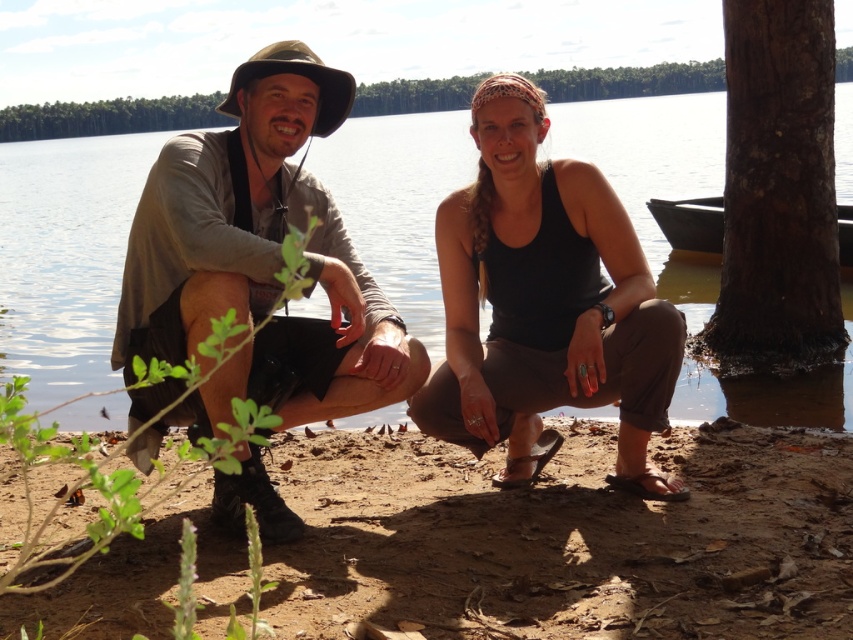
Question: Which point is closer to the camera?

Choices:
 (A) (846, 260)
 (B) (219, 97)

Answer: (A)

Question: Based on their relative distances, which object is nearer to the brown dirt at lower center?

Choices:
 (A) dark brown wooden canoe at right
 (B) matte gray shirt at center

Answer: (B)

Question: Estimate the real-world distances between objects in this image. Which object is closer to the dark brown wooden canoe at right?

Choices:
 (A) brown dirt at lower center
 (B) brown fabric hat at left
 (C) brown rough bark tree at right

Answer: (C)

Question: From the image, what is the correct spatial relationship of brown dirt at lower center in relation to brown fabric hat at left?

Choices:
 (A) above
 (B) below

Answer: (B)

Question: Does black matte tank top at center have a larger size compared to brown fabric hat at left?

Choices:
 (A) yes
 (B) no

Answer: (A)

Question: Is black matte tank top at center positioned at the back of dark brown wooden canoe at right?

Choices:
 (A) no
 (B) yes

Answer: (A)